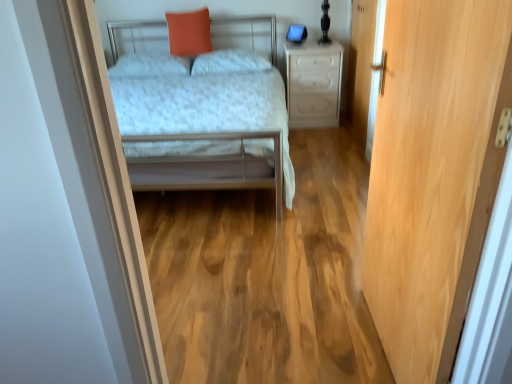
Question: Considering the relative sizes of metallic silver bed at center and white soft pillow at center, acting as the 2th pillow starting from the right, in the image provided, is metallic silver bed at center bigger than white soft pillow at center, acting as the 2th pillow starting from the right,?

Choices:
 (A) yes
 (B) no

Answer: (A)

Question: Can you see metallic silver bed at center touching white soft pillow at center, acting as the 2th pillow starting from the right?

Choices:
 (A) yes
 (B) no

Answer: (B)

Question: Considering the relative sizes of metallic silver bed at center and white soft pillow at center, which is the first pillow from left to right, in the image provided, is metallic silver bed at center thinner than white soft pillow at center, which is the first pillow from left to right,?

Choices:
 (A) no
 (B) yes

Answer: (A)

Question: Does metallic silver bed at center have a smaller size compared to white soft pillow at center, acting as the 2th pillow starting from the right?

Choices:
 (A) yes
 (B) no

Answer: (B)

Question: Is metallic silver bed at center taller than white soft pillow at center, acting as the 2th pillow starting from the right?

Choices:
 (A) no
 (B) yes

Answer: (B)

Question: From the image's perspective, relative to white soft pillow at center, acting as the 2th pillow starting from the right, is metallic silver bed at center above or below?

Choices:
 (A) below
 (B) above

Answer: (A)

Question: From a real-world perspective, is metallic silver bed at center above or below white soft pillow at center, which is the first pillow from left to right?

Choices:
 (A) above
 (B) below

Answer: (B)

Question: Which is correct: metallic silver bed at center is inside white soft pillow at center, which is the first pillow from left to right, or outside of it?

Choices:
 (A) inside
 (B) outside

Answer: (B)

Question: Considering their positions, is metallic silver bed at center located in front of or behind white soft pillow at center, acting as the 2th pillow starting from the right?

Choices:
 (A) front
 (B) behind

Answer: (A)

Question: From a real-world perspective, relative to metallic silver bed at center, is light wood door at right vertically above or below?

Choices:
 (A) below
 (B) above

Answer: (B)

Question: Would you say light wood door at right is to the left or to the right of metallic silver bed at center in the picture?

Choices:
 (A) right
 (B) left

Answer: (A)

Question: From their relative heights in the image, would you say light wood door at right is taller or shorter than metallic silver bed at center?

Choices:
 (A) tall
 (B) short

Answer: (A)

Question: Do you think light wood door at right is within metallic silver bed at center, or outside of it?

Choices:
 (A) inside
 (B) outside

Answer: (B)

Question: Looking at their shapes, would you say white plastic drawer at center is wider or thinner than wooden door at right?

Choices:
 (A) thin
 (B) wide

Answer: (B)

Question: From a real-world perspective, relative to wooden door at right, is white plastic drawer at center vertically above or below?

Choices:
 (A) above
 (B) below

Answer: (B)